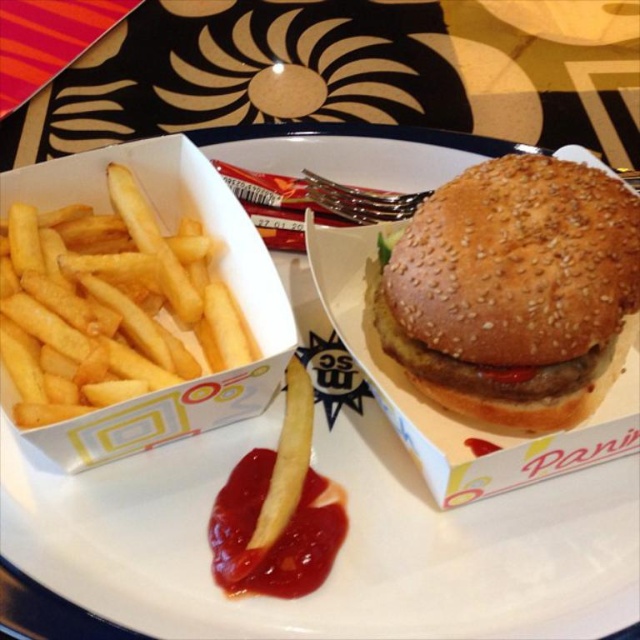
You are a food delivery person who needs to place a hot beverage in the space between the sesame seed bun at center and the red glossy ketchup at lower center. Can you fit it there?

The sesame seed bun at center is in front of the red glossy ketchup at lower center, so there is no space between them for the beverage.